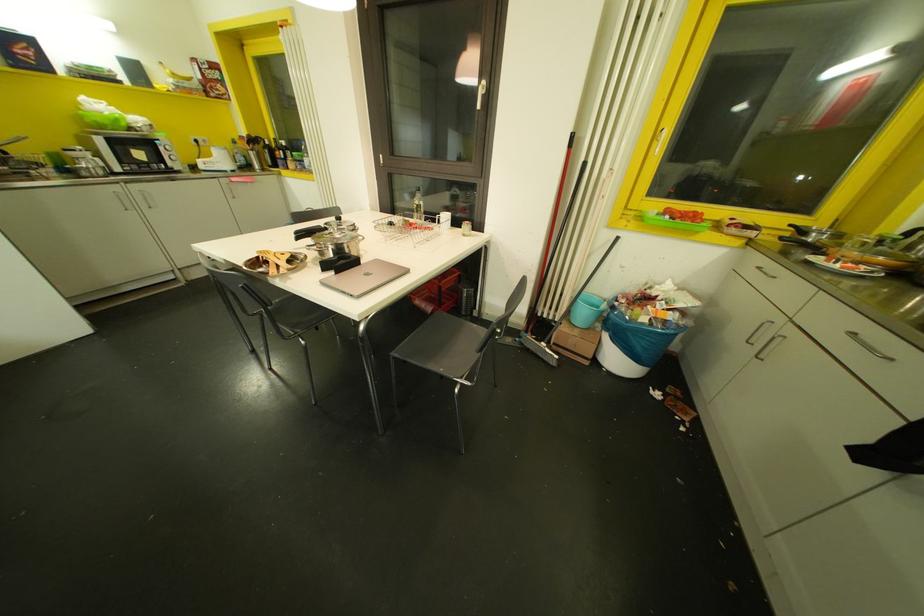
What do you see at coordinates (418, 205) in the screenshot? I see `the glass bottle` at bounding box center [418, 205].